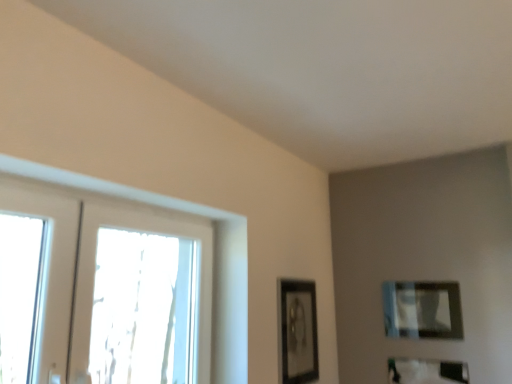
Question: Considering the positions of clear glass window at left and matte black picture frame at center, acting as the 3th picture frame starting from the right, in the image, is clear glass window at left taller or shorter than matte black picture frame at center, acting as the 3th picture frame starting from the right,?

Choices:
 (A) short
 (B) tall

Answer: (B)

Question: Choose the correct answer: Is clear glass window at left inside matte black picture frame at center, marked as the first picture frame in a left-to-right arrangement, or outside it?

Choices:
 (A) inside
 (B) outside

Answer: (B)

Question: Which object is positioned farthest from the matte black picture frame at upper right, which is counted as the 2th picture frame, starting from the left?

Choices:
 (A) clear glass window at left
 (B) matte black picture frame at center, acting as the 3th picture frame starting from the right
 (C) matte black picture frame at lower right, marked as the 1th picture frame in a right-to-left arrangement

Answer: (A)

Question: Which object is positioned closest to the matte black picture frame at upper right, which is counted as the 2th picture frame, starting from the right?

Choices:
 (A) clear glass window at left
 (B) matte black picture frame at center, acting as the 3th picture frame starting from the right
 (C) matte black picture frame at lower right, marked as the 1th picture frame in a right-to-left arrangement

Answer: (C)